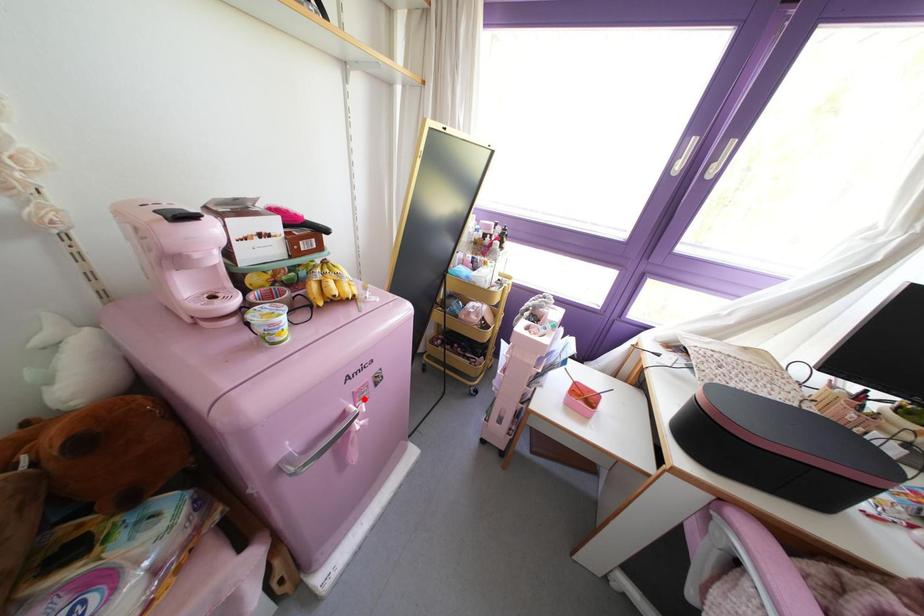
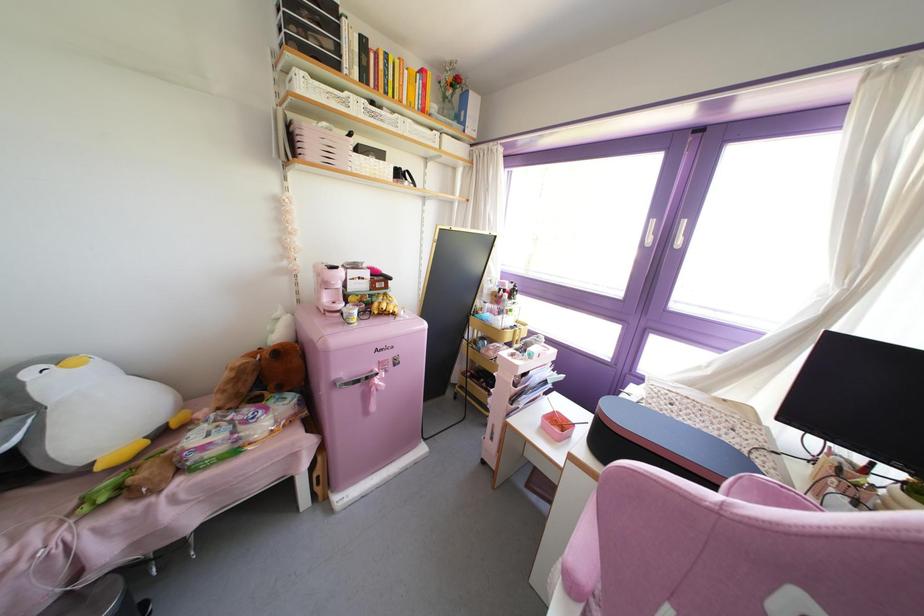
Locate, in the second image, the point that corresponds to the highlighted location in the first image.

(385, 371)